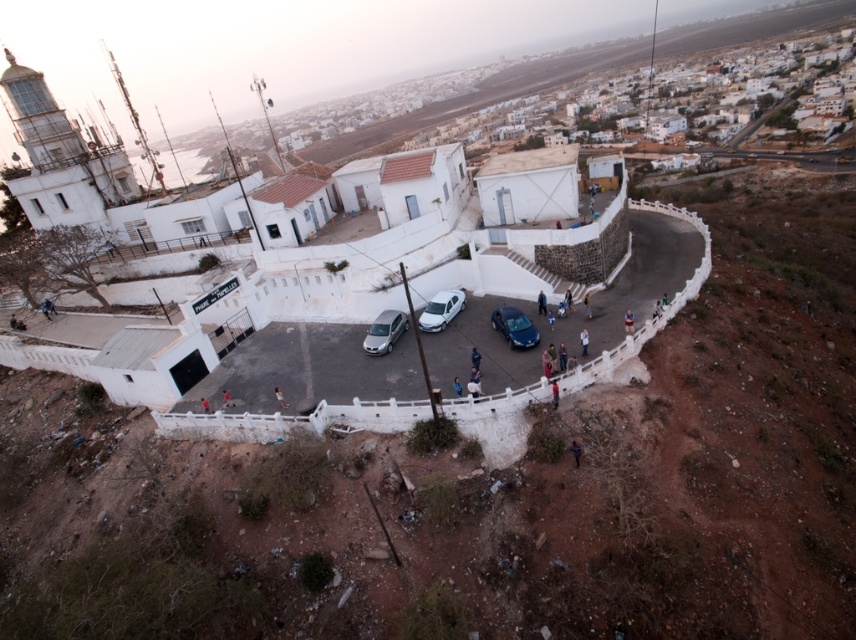
Question: Which point appears farthest from the camera in this image?

Choices:
 (A) (581, 353)
 (B) (226, 394)

Answer: (B)

Question: Does light blue shirt at center appear on the left side of blue denim jeans at lower center?

Choices:
 (A) yes
 (B) no

Answer: (A)

Question: Is shiny dark blue sedan at center wider than blue fabric person at lower center?

Choices:
 (A) no
 (B) yes

Answer: (B)

Question: Estimate the real-world distances between objects in this image. Which object is closer to the blue fabric person at lower center?

Choices:
 (A) shiny dark blue sedan at center
 (B) light blue shirt at center
 (C) smooth skin person at center
 (D) dark blue jeans at center

Answer: (A)

Question: Is satin silver van at center further to camera compared to red fabric person at center?

Choices:
 (A) no
 (B) yes

Answer: (B)

Question: Which point is farther from the camera taking this photo?

Choices:
 (A) (563, 362)
 (B) (230, 403)
 (C) (565, 296)

Answer: (C)